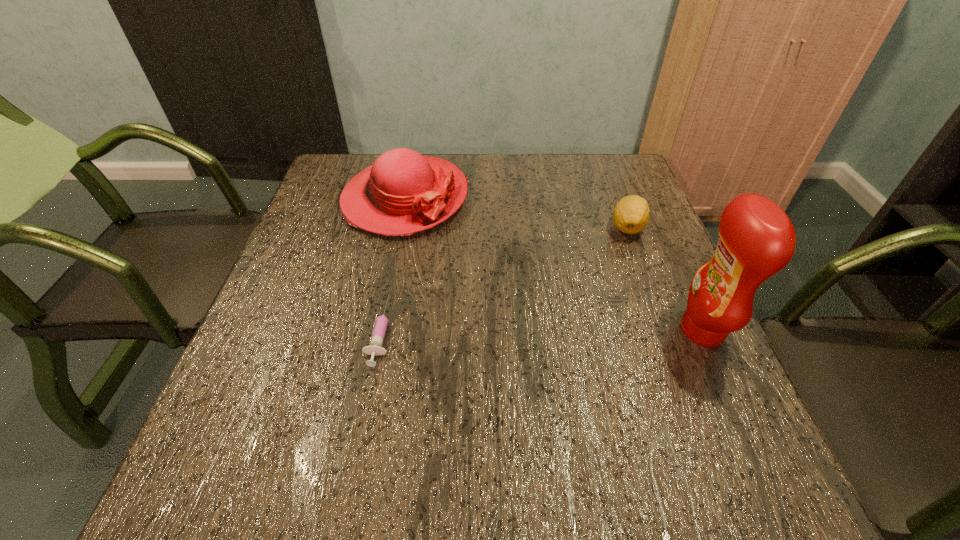
The height and width of the screenshot is (540, 960). Find the location of `syringe`. syringe is located at coordinates (375, 348).

At what (x,y) coordinates should I click in order to perform the action: click on condiment. Please return your answer as a coordinate pair (x, y). The width and height of the screenshot is (960, 540). Looking at the image, I should click on (756, 240).

You are a GUI agent. You are given a task and a screenshot of the screen. Output one action in this format:
    pyautogui.click(x=<x>, y=<y>)
    Task: Click on the third shortest object
    The height and width of the screenshot is (540, 960).
    Given the screenshot: What is the action you would take?
    pyautogui.click(x=402, y=193)

The height and width of the screenshot is (540, 960). What are the coordinates of `the second shortest object` in the screenshot? It's located at (631, 214).

The height and width of the screenshot is (540, 960). Find the location of `vacant space located on the left of the syringe`. vacant space located on the left of the syringe is located at coordinates (258, 331).

The height and width of the screenshot is (540, 960). I want to click on vacant space located on the label side of the condiment, so click(643, 330).

This screenshot has height=540, width=960. I want to click on free space located 0.310m on the label side of the condiment, so click(523, 330).

Find the location of a particular element. The image size is (960, 540). vacant area located on the label side of the condiment is located at coordinates (493, 330).

At what (x,y) coordinates should I click in order to perform the action: click on vacant space positioned at the front of the second tallest object with a bow. Please return your answer as a coordinate pair (x, y). Image resolution: width=960 pixels, height=540 pixels. Looking at the image, I should click on (463, 278).

Locate an element on the screen. free space located at the front of the second tallest object with a bow is located at coordinates (480, 301).